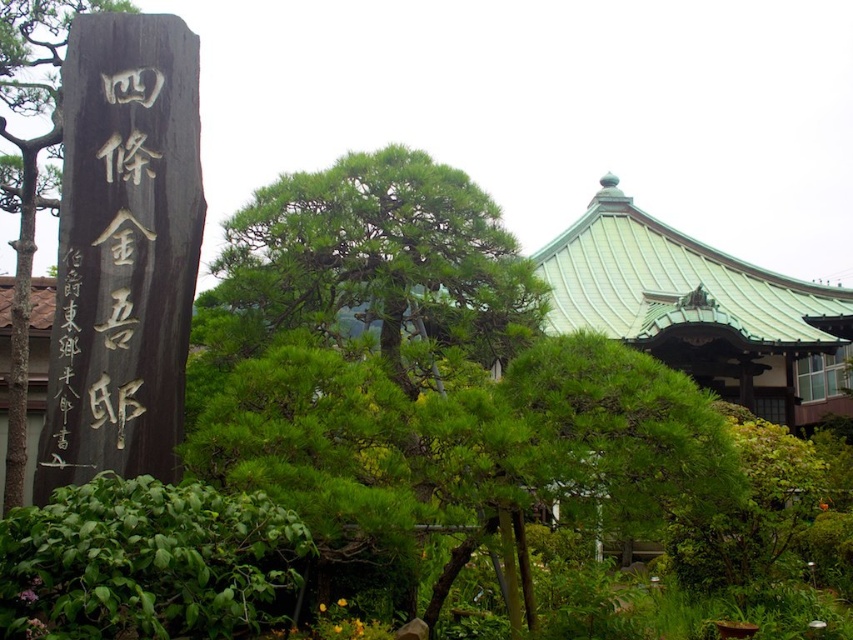
You are a visitor in the Japanese garden and want to take a photo of both the black wood sign at left and the green leafy tree at left. Which object should you focus on first to ensure both are in frame?

You should focus on the green leafy tree at left first because it is larger than the black wood sign at left, so positioning the camera to include its full size will naturally include the smaller sign in the frame as well.

You are standing in the Japanese garden and want to take a photo. You notice two points marked in the scene. Which point, point (91, 262) or point (15, 280), is closer to you?

Point (91, 262) is closer to the camera than point (15, 280).

You are standing in the Japanese garden and see the point marked at coordinates (x=105, y=269). Which object is this point located on?

The point is located on the black wood sign at left.